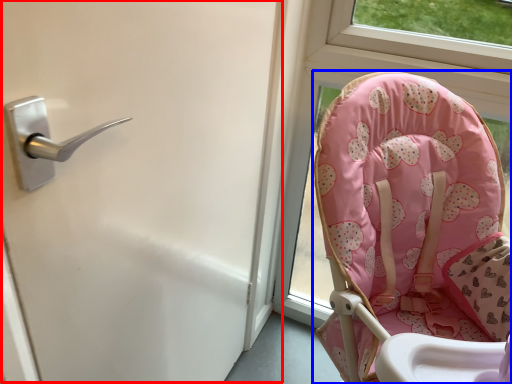
Question: Which point is further to the camera, screen door (highlighted by a red box) or chair (highlighted by a blue box)?

Choices:
 (A) screen door
 (B) chair

Answer: (B)